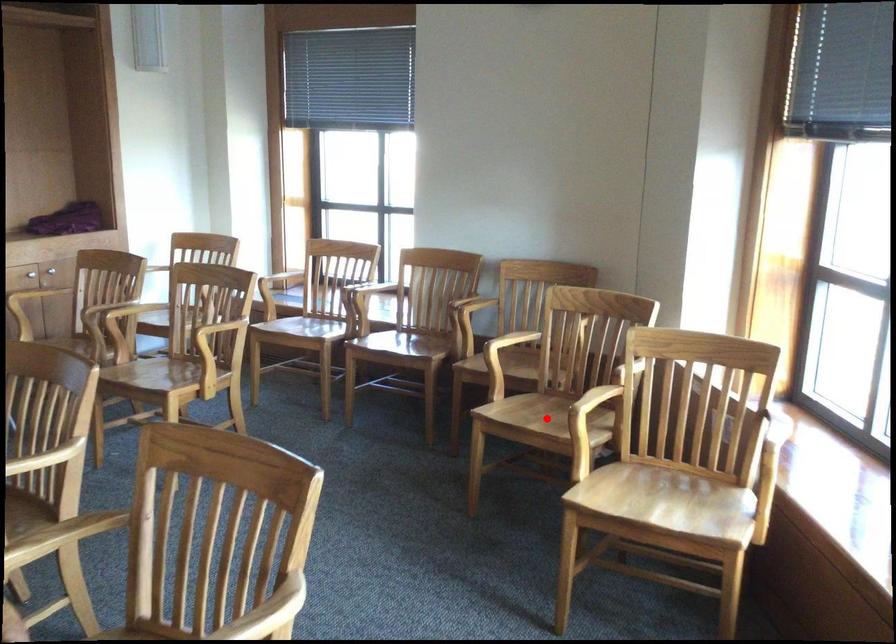
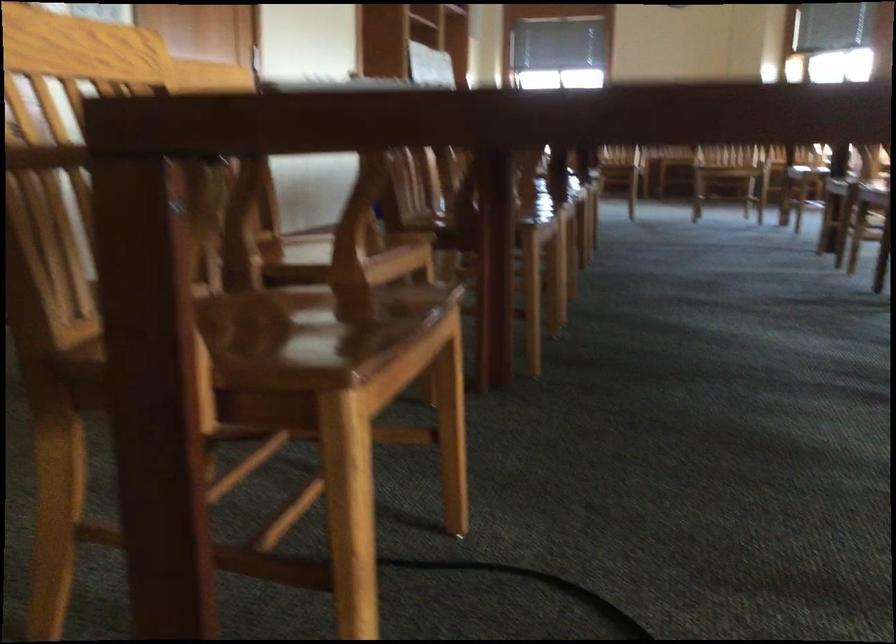
Question: I am providing you with two images of the same scene from different viewpoints. A red point is marked on the first image. At the location where the point appears in image 1, is it still visible in image 2?

Choices:
 (A) Yes
 (B) No

Answer: (B)